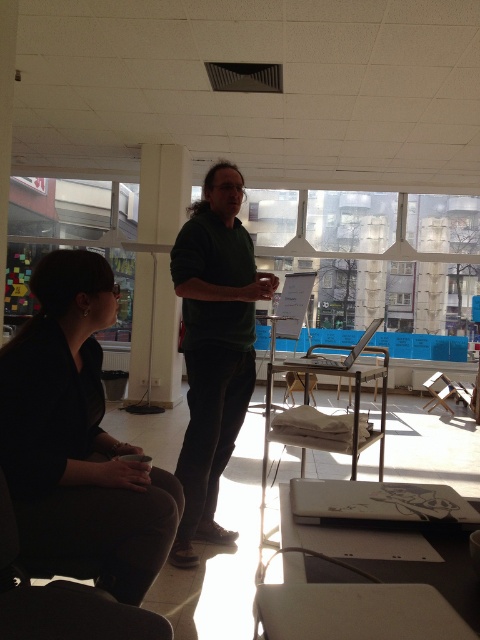
In the scene shown: You are standing in the meeting room and need to locate the dark brown fabric jacket at lower left. Where exactly is it positioned in the room?

The dark brown fabric jacket at lower left is positioned at point (x=78, y=436) in the room.

You are a security guard in the room. You need to check if the dark brown fabric jacket at lower left is placed on the black fabric chair at lower left. Based on the scene, can you confirm this?

The dark brown fabric jacket at lower left is above the black fabric chair at lower left, so it is placed on the chair.